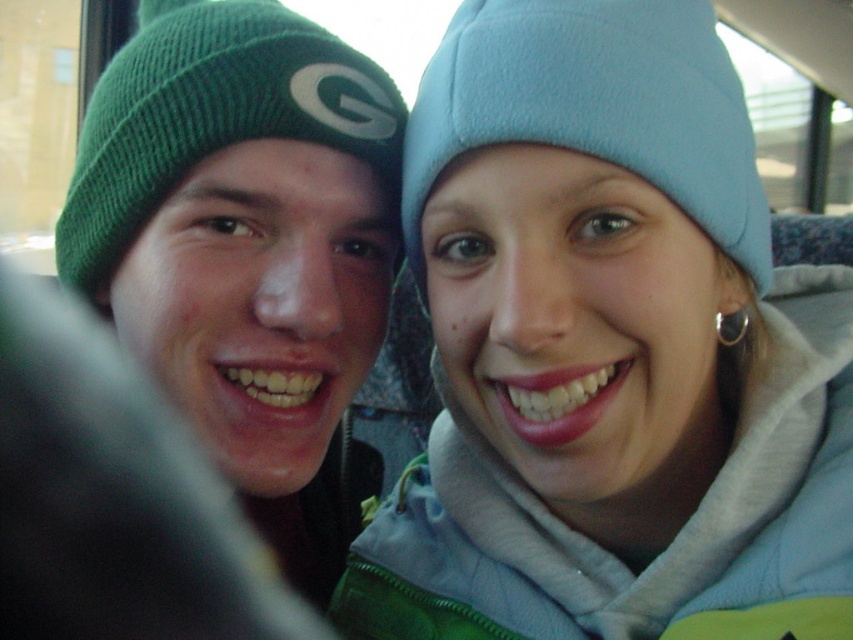
Question: Which object appears closest to the camera in this image?

Choices:
 (A) light blue fleece beanie at upper right
 (B) green knitted beanie at left

Answer: (A)

Question: Which object is closer to the camera taking this photo?

Choices:
 (A) light blue fleece beanie at upper right
 (B) green knitted beanie at left

Answer: (A)

Question: Which point is closer to the camera?

Choices:
 (A) (141, 68)
 (B) (511, 36)

Answer: (B)

Question: Is light blue fleece beanie at upper right positioned before green knitted beanie at left?

Choices:
 (A) no
 (B) yes

Answer: (B)

Question: Can you confirm if light blue fleece beanie at upper right is positioned to the left of green knitted beanie at left?

Choices:
 (A) no
 (B) yes

Answer: (A)

Question: Can you confirm if light blue fleece beanie at upper right is bigger than green knitted beanie at left?

Choices:
 (A) no
 (B) yes

Answer: (A)